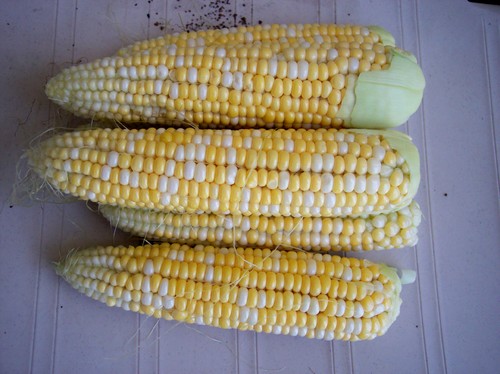
Locate an element on the screen. white surface is located at coordinates (461, 245).